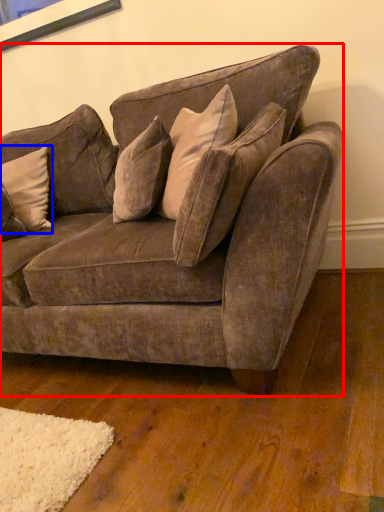
Question: Among these objects, which one is farthest to the camera, studio couch (highlighted by a red box) or pillow (highlighted by a blue box)?

Choices:
 (A) studio couch
 (B) pillow

Answer: (B)